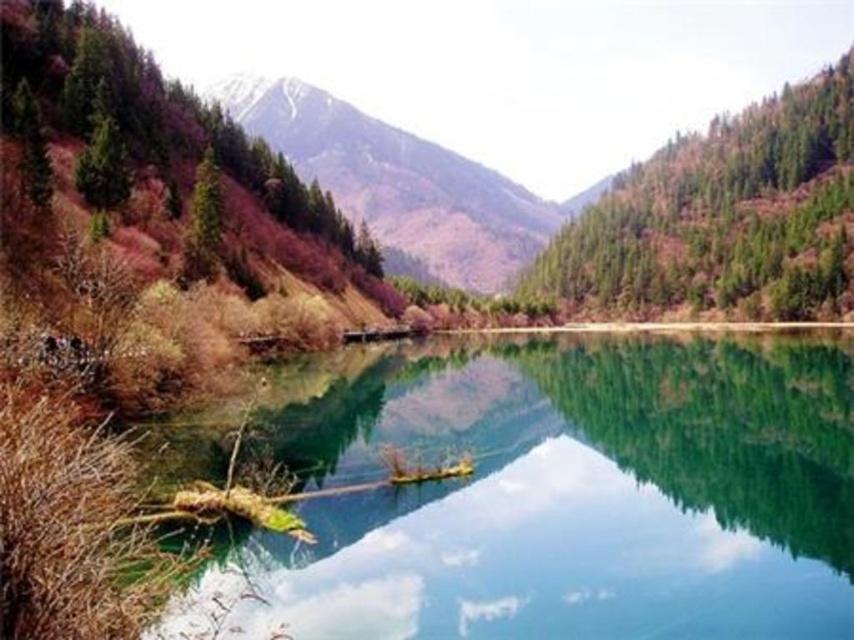
Question: Considering the real-world distances, which object is closest to the green matte tree at upper left?

Choices:
 (A) green forested mountain at upper center
 (B) green smooth water at center
 (C) green leafy tree at upper left
 (D) green matte forest at upper center

Answer: (C)

Question: Does green leafy tree at upper left appear on the left side of green forested mountain at upper center?

Choices:
 (A) no
 (B) yes

Answer: (A)

Question: Does green leafy tree at upper left appear over green forested mountain at upper center?

Choices:
 (A) yes
 (B) no

Answer: (B)

Question: Which of the following is the closest to the observer?

Choices:
 (A) green forested mountain at upper center
 (B) green smooth water at center
 (C) green matte tree at upper left

Answer: (B)

Question: From the image, what is the correct spatial relationship of green smooth water at center in relation to green forested mountain at upper center?

Choices:
 (A) left
 (B) right

Answer: (B)

Question: Among these objects, which one is nearest to the camera?

Choices:
 (A) green matte forest at upper center
 (B) green forested mountain at upper center
 (C) green matte tree at upper left
 (D) green smooth water at center

Answer: (D)